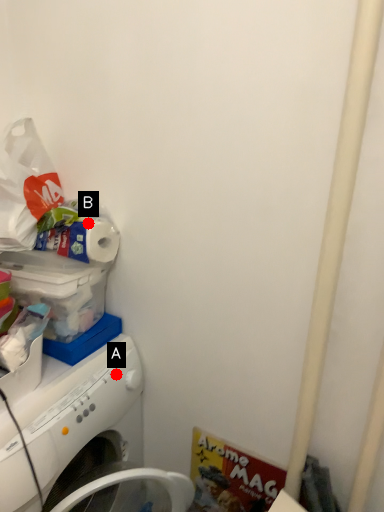
Question: Two points are circled on the image, labeled by A and B beside each circle. Which point is closer to the camera?

Choices:
 (A) A is closer
 (B) B is closer

Answer: (B)